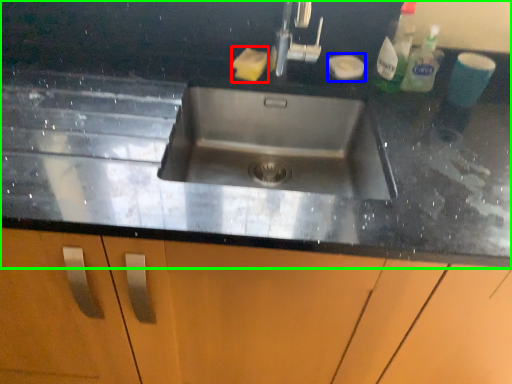
Question: Based on their relative distances, which object is farther from soap (highlighted by a red box)? Choose from soap (highlighted by a blue box) and countertop (highlighted by a green box).

Choices:
 (A) soap
 (B) countertop

Answer: (B)